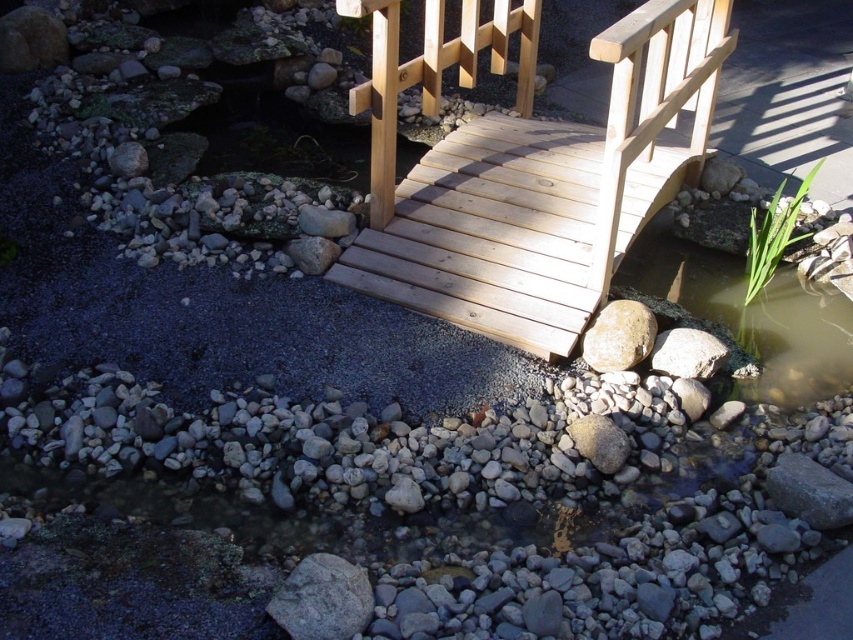
You are standing at the entrance of the natural wood bridge at center. If you walk straight ahead, which direction will you face relative to the bridge?

Since the natural wood bridge at center is located at point (527, 170), walking straight ahead from the entrance would lead you towards the center of the bridge, maintaining the same direction relative to the bridge.

You are standing on the wooden bridge and looking down at the gray rough rock at lower right and the smooth gray rock at center. Which rock appears taller from your viewpoint?

The gray rough rock at lower right is taller than the smooth gray rock at center, so it appears taller from your viewpoint on the bridge.

You are standing on the wooden bridge and looking at two points marked in the scene. Which point, point (350, 580) or point (683, 371), is closer to you?

Point (350, 580) is closer to you than point (683, 371).